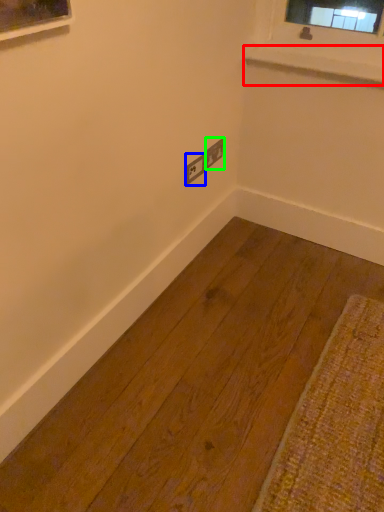
Question: Which is farther away from window sill (highlighted by a red box)? electric outlet (highlighted by a blue box) or electric outlet (highlighted by a green box)?

Choices:
 (A) electric outlet
 (B) electric outlet

Answer: (A)